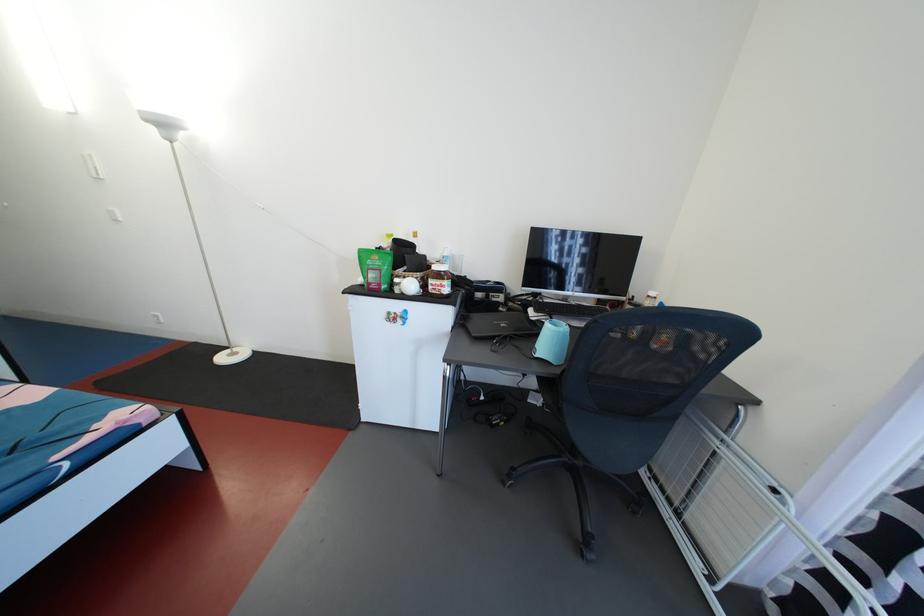
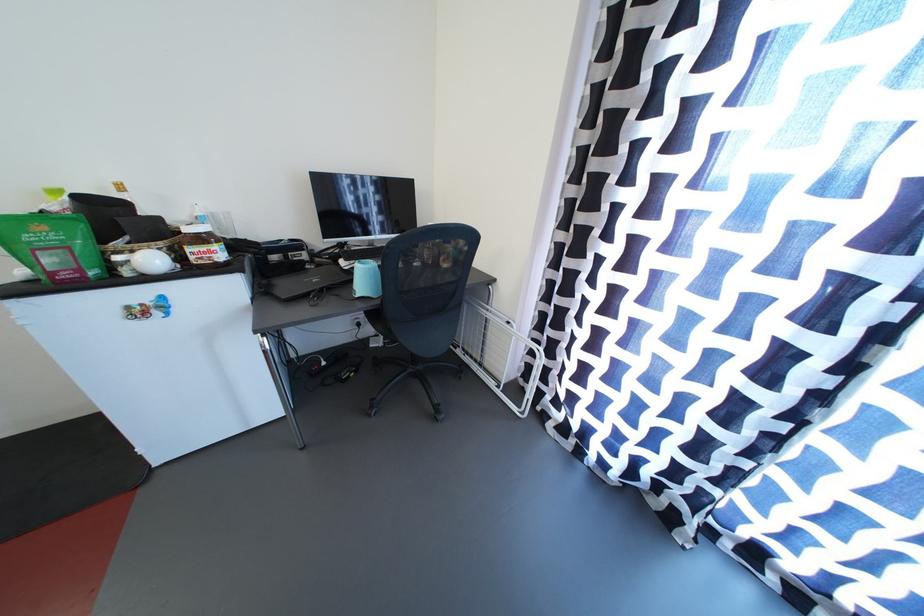
Where in the second image is the point corresponding to (x=402, y=273) from the first image?

(110, 246)